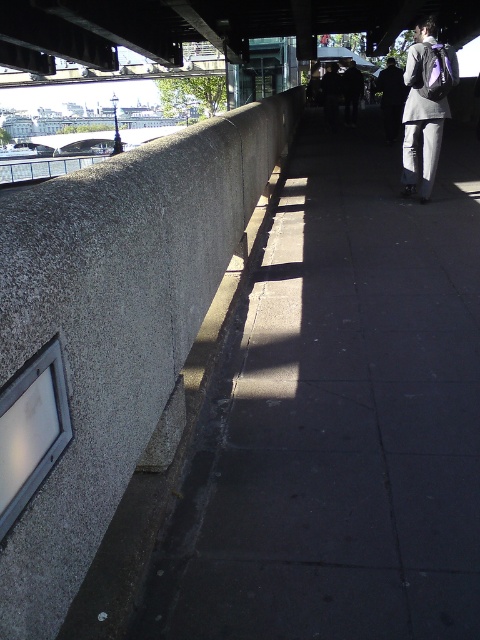
You are a maintenance worker needing to place a 2x2 meter tarp over the gray concrete pavement at center and the gray concrete ledge at left. Which area requires a larger tarp?

The gray concrete pavement at center requires a larger tarp because it is larger in size than the gray concrete ledge at left.

You are standing on the walkway under the bridge and see the gray concrete ledge at left and the gray fabric backpack at right. Which object is closer to you?

The gray concrete ledge at left is closer to you because it is in front of the gray fabric backpack at right.

You are standing at the center of the walkway under the bridge. You want to place a small potted plant exactly at the position of the gray concrete ledge at left. Where should you place the plant relative to the walkway?

The gray concrete ledge at left is located at point coordinates 0.503 on the x axis and 0.244 on the y axis, so you should place the potted plant at those coordinates relative to the walkway.